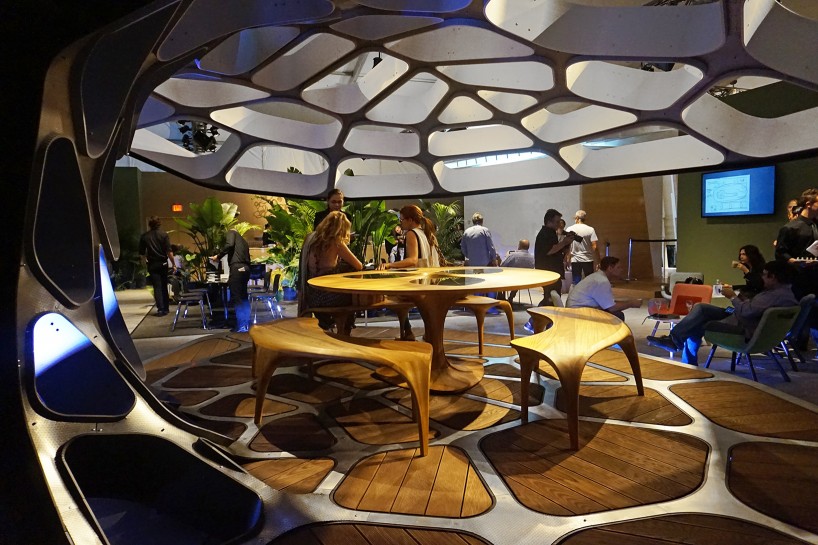
The image size is (818, 545). Find the location of `green plants in center back area of image`. green plants in center back area of image is located at coordinates (291, 217), (375, 219), (447, 213), (226, 213).